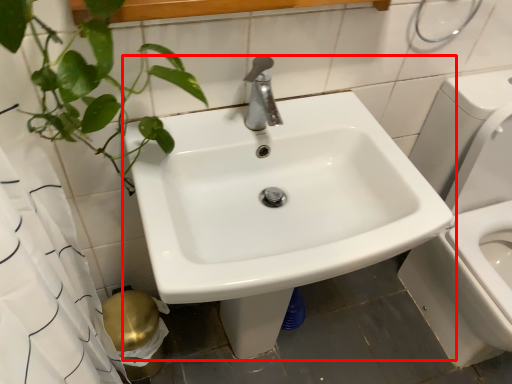
Question: From the image's perspective, what is the correct spatial positioning of sink (annotated by the red box) in reference to toilet paper?

Choices:
 (A) below
 (B) above

Answer: (B)